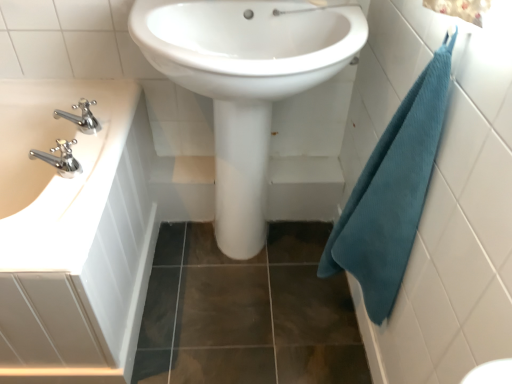
Question: From the image's perspective, is teal waffle towel at right located beneath chrome metallic faucet at left?

Choices:
 (A) no
 (B) yes

Answer: (B)

Question: Can chrome metallic faucet at left be found inside teal waffle towel at right?

Choices:
 (A) yes
 (B) no

Answer: (B)

Question: Is teal waffle towel at right not close to chrome metallic faucet at left?

Choices:
 (A) no
 (B) yes

Answer: (A)

Question: Is teal waffle towel at right thinner than chrome metallic faucet at left?

Choices:
 (A) no
 (B) yes

Answer: (A)

Question: Does teal waffle towel at right have a greater height compared to chrome metallic faucet at left?

Choices:
 (A) no
 (B) yes

Answer: (B)

Question: Is teal waffle towel at right bigger than chrome metallic faucet at left?

Choices:
 (A) yes
 (B) no

Answer: (A)

Question: From a real-world perspective, is white glossy sink at center, positioned as the second sink in left-to-right order, on white glossy sink at left, placed as the first sink when sorted from left to right?

Choices:
 (A) yes
 (B) no

Answer: (A)

Question: Does white glossy sink at center, positioned as the second sink in left-to-right order, turn towards white glossy sink at left, which ranks as the 2th sink in right-to-left order?

Choices:
 (A) yes
 (B) no

Answer: (B)

Question: Does white glossy sink at center, positioned as the second sink in left-to-right order, have a lesser width compared to white glossy sink at left, which ranks as the 2th sink in right-to-left order?

Choices:
 (A) yes
 (B) no

Answer: (A)

Question: Is white glossy sink at center, marked as the first sink in a right-to-left arrangement, with white glossy sink at left, placed as the first sink when sorted from left to right?

Choices:
 (A) yes
 (B) no

Answer: (B)

Question: From the image's perspective, is white glossy sink at center, positioned as the second sink in left-to-right order, above white glossy sink at left, which ranks as the 2th sink in right-to-left order?

Choices:
 (A) yes
 (B) no

Answer: (A)

Question: Is white glossy sink at center, marked as the first sink in a right-to-left arrangement, looking in the opposite direction of white glossy sink at left, which ranks as the 2th sink in right-to-left order?

Choices:
 (A) no
 (B) yes

Answer: (A)

Question: Can you confirm if white glossy sink at left, placed as the first sink when sorted from left to right, is taller than white glossy sink at center, marked as the first sink in a right-to-left arrangement?

Choices:
 (A) yes
 (B) no

Answer: (B)